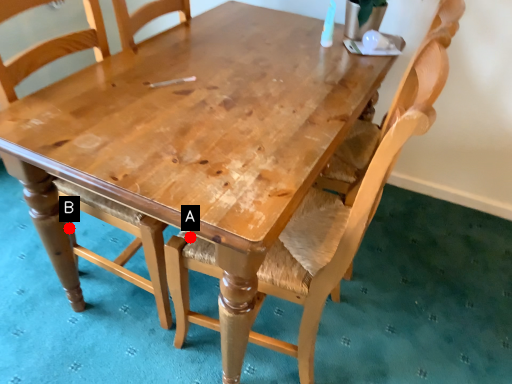
Question: Two points are circled on the image, labeled by A and B beside each circle. Among these points, which one is nearest to the camera?

Choices:
 (A) A is closer
 (B) B is closer

Answer: (A)